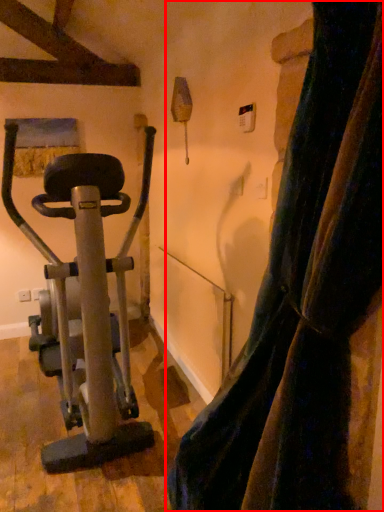
Question: Observing the image, what is the correct spatial positioning of curtain (annotated by the red box) in reference to stationary bicycle?

Choices:
 (A) right
 (B) left

Answer: (A)